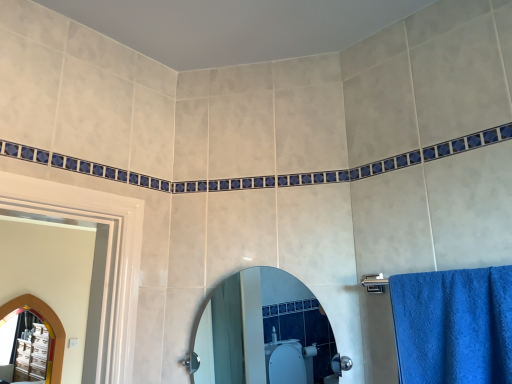
Find the location of a particular element. The width and height of the screenshot is (512, 384). arched wooden mirror at left, which is the first mirror in bottom-to-top order is located at coordinates [x=46, y=327].

Describe the element at coordinates (46, 327) in the screenshot. I see `arched wooden mirror at left, acting as the 2th mirror starting from the right` at that location.

Where is `clear glass mirror at center, the 1th mirror positioned from the right`? clear glass mirror at center, the 1th mirror positioned from the right is located at coordinates (263, 332).

Describe the element at coordinates (263, 332) in the screenshot. I see `clear glass mirror at center, placed as the second mirror when sorted from bottom to top` at that location.

Image resolution: width=512 pixels, height=384 pixels. Identify the location of arched wooden mirror at left, which appears as the first mirror when viewed from the left. (46, 327).

Considering the relative positions of clear glass mirror at center, positioned as the second mirror in back-to-front order, and arched wooden mirror at left, which is the first mirror in bottom-to-top order, in the image provided, is clear glass mirror at center, positioned as the second mirror in back-to-front order, to the left of arched wooden mirror at left, which is the first mirror in bottom-to-top order, from the viewer's perspective?

No, clear glass mirror at center, positioned as the second mirror in back-to-front order, is not to the left of arched wooden mirror at left, which is the first mirror in bottom-to-top order.

Is clear glass mirror at center, placed as the second mirror when sorted from left to right, positioned behind arched wooden mirror at left, the 2th mirror positioned from the front?

No, clear glass mirror at center, placed as the second mirror when sorted from left to right, is in front of arched wooden mirror at left, the 2th mirror positioned from the front.

Which is less distant, [249,355] or [10,318]?

Positioned in front is point [249,355].

From the image's perspective, is clear glass mirror at center, the 1th mirror positioned from the right, located above arched wooden mirror at left, acting as the 2th mirror starting from the right?

Correct, clear glass mirror at center, the 1th mirror positioned from the right, appears higher than arched wooden mirror at left, acting as the 2th mirror starting from the right, in the image.

From a real-world perspective, does clear glass mirror at center, which is the first mirror from front to back, sit lower than arched wooden mirror at left, which is counted as the 1th mirror, starting from the back?

No, from a real-world perspective, clear glass mirror at center, which is the first mirror from front to back, is not beneath arched wooden mirror at left, which is counted as the 1th mirror, starting from the back.

Can you confirm if clear glass mirror at center, positioned as the second mirror in back-to-front order, is wider than arched wooden mirror at left, which is the first mirror in bottom-to-top order?

Yes.

Is clear glass mirror at center, placed as the second mirror when sorted from bottom to top, taller or shorter than arched wooden mirror at left, which appears as the first mirror when viewed from the left?

In the image, clear glass mirror at center, placed as the second mirror when sorted from bottom to top, appears to be shorter than arched wooden mirror at left, which appears as the first mirror when viewed from the left.

Is clear glass mirror at center, the first mirror from the top, smaller than arched wooden mirror at left, which appears as the first mirror when viewed from the left?

Correct, clear glass mirror at center, the first mirror from the top, occupies less space than arched wooden mirror at left, which appears as the first mirror when viewed from the left.

Is clear glass mirror at center, placed as the second mirror when sorted from bottom to top, inside or outside of arched wooden mirror at left, the 2th mirror positioned from the front?

clear glass mirror at center, placed as the second mirror when sorted from bottom to top, exists outside the volume of arched wooden mirror at left, the 2th mirror positioned from the front.

Is clear glass mirror at center, positioned as the second mirror in back-to-front order, touching arched wooden mirror at left, which appears as the first mirror when viewed from the left?

No, clear glass mirror at center, positioned as the second mirror in back-to-front order, is not in contact with arched wooden mirror at left, which appears as the first mirror when viewed from the left.

Is clear glass mirror at center, which is the first mirror from front to back, aimed at arched wooden mirror at left, the 2th mirror positioned from the front?

No, clear glass mirror at center, which is the first mirror from front to back, is not facing towards arched wooden mirror at left, the 2th mirror positioned from the front.

How many degrees apart are the facing directions of clear glass mirror at center, placed as the second mirror when sorted from bottom to top, and arched wooden mirror at left, the 2th mirror positioned from the front?

The angle between the facing direction of clear glass mirror at center, placed as the second mirror when sorted from bottom to top, and the facing direction of arched wooden mirror at left, the 2th mirror positioned from the front, is 55.3 degrees.

Looking at this image, could you measure the distance between clear glass mirror at center, the first mirror from the top, and arched wooden mirror at left, the 2th mirror positioned from the front?

The distance of clear glass mirror at center, the first mirror from the top, from arched wooden mirror at left, the 2th mirror positioned from the front, is 7.51 feet.

Identify the location of mirror in front of the arched wooden mirror at left, arranged as the 2th mirror when viewed from the top. The width and height of the screenshot is (512, 384). 263,332.

Is arched wooden mirror at left, the 2th mirror positioned from the front, to the left of clear glass mirror at center, placed as the second mirror when sorted from bottom to top, from the viewer's perspective?

Indeed, arched wooden mirror at left, the 2th mirror positioned from the front, is positioned on the left side of clear glass mirror at center, placed as the second mirror when sorted from bottom to top.

Is arched wooden mirror at left, arranged as the 2th mirror when viewed from the top, in front of or behind clear glass mirror at center, the 1th mirror positioned from the right, in the image?

Clearly, arched wooden mirror at left, arranged as the 2th mirror when viewed from the top, is behind clear glass mirror at center, the 1th mirror positioned from the right.

Does point (15, 310) come closer to viewer compared to point (270, 294)?

That is False.

From the image's perspective, is arched wooden mirror at left, which is the first mirror in bottom-to-top order, below clear glass mirror at center, the 1th mirror positioned from the right?

Yes.

From a real-world perspective, between arched wooden mirror at left, the 2th mirror positioned from the front, and clear glass mirror at center, placed as the second mirror when sorted from bottom to top, who is vertically lower?

arched wooden mirror at left, the 2th mirror positioned from the front, from a real-world perspective.

Is arched wooden mirror at left, which is the first mirror in bottom-to-top order, thinner than clear glass mirror at center, placed as the second mirror when sorted from bottom to top?

Indeed, arched wooden mirror at left, which is the first mirror in bottom-to-top order, has a lesser width compared to clear glass mirror at center, placed as the second mirror when sorted from bottom to top.

From their relative heights in the image, would you say arched wooden mirror at left, which appears as the first mirror when viewed from the left, is taller or shorter than clear glass mirror at center, which is the first mirror from front to back?

Considering their sizes, arched wooden mirror at left, which appears as the first mirror when viewed from the left, has more height than clear glass mirror at center, which is the first mirror from front to back.

Between arched wooden mirror at left, arranged as the 2th mirror when viewed from the top, and clear glass mirror at center, the 1th mirror positioned from the right, which one has larger size?

Bigger between the two is arched wooden mirror at left, arranged as the 2th mirror when viewed from the top.

Does arched wooden mirror at left, the 2th mirror positioned from the front, contain clear glass mirror at center, placed as the second mirror when sorted from bottom to top?

Definitely not — clear glass mirror at center, placed as the second mirror when sorted from bottom to top, is not inside arched wooden mirror at left, the 2th mirror positioned from the front.

Are arched wooden mirror at left, which appears as the first mirror when viewed from the left, and clear glass mirror at center, positioned as the second mirror in back-to-front order, located far from each other?

Yes.

Is arched wooden mirror at left, the 2th mirror positioned from the front, facing towards clear glass mirror at center, positioned as the second mirror in back-to-front order?

Yes, arched wooden mirror at left, the 2th mirror positioned from the front, is oriented towards clear glass mirror at center, positioned as the second mirror in back-to-front order.

Consider the image. What's the angular difference between arched wooden mirror at left, which is the first mirror in bottom-to-top order, and clear glass mirror at center, which is the first mirror from front to back,'s facing directions?

55.3 degrees separate the facing orientations of arched wooden mirror at left, which is the first mirror in bottom-to-top order, and clear glass mirror at center, which is the first mirror from front to back.

How far apart are arched wooden mirror at left, which is counted as the 1th mirror, starting from the back, and clear glass mirror at center, which is the first mirror from front to back?

A distance of 7.51 feet exists between arched wooden mirror at left, which is counted as the 1th mirror, starting from the back, and clear glass mirror at center, which is the first mirror from front to back.

At what (x,y) coordinates should I click in order to perform the action: click on mirror that appears below the clear glass mirror at center, which is the first mirror from front to back (from the image's perspective). Please return your answer as a coordinate pair (x, y). The height and width of the screenshot is (384, 512). Looking at the image, I should click on (46, 327).

Locate an element on the screen. The height and width of the screenshot is (384, 512). mirror in front of the arched wooden mirror at left, which is the first mirror in bottom-to-top order is located at coordinates (263, 332).

In the image, there is a arched wooden mirror at left, which appears as the first mirror when viewed from the left. Identify the location of mirror above it (from the image's perspective). (263, 332).